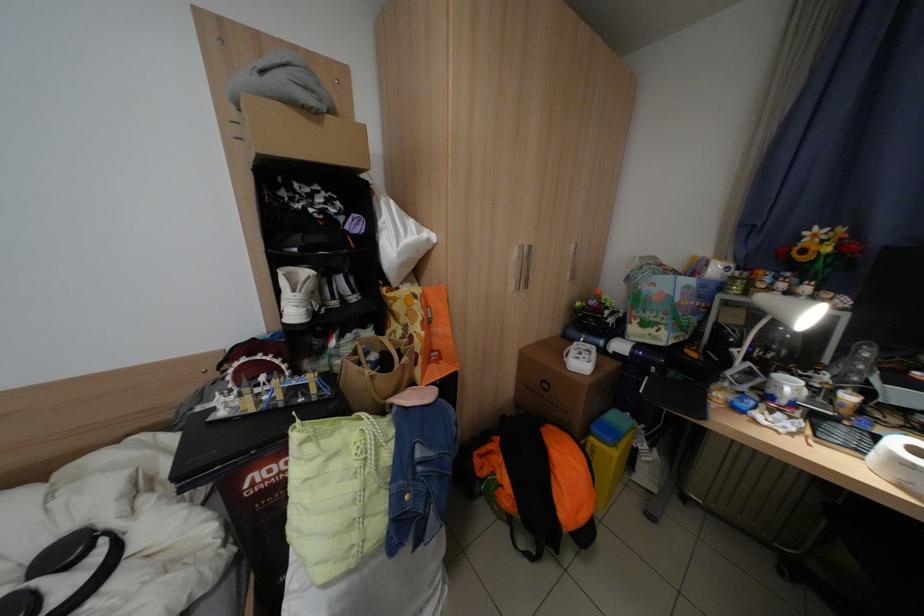
Find where to lift the lime green bag. Please return your answer as a coordinate pair (x, y).

(337, 492)